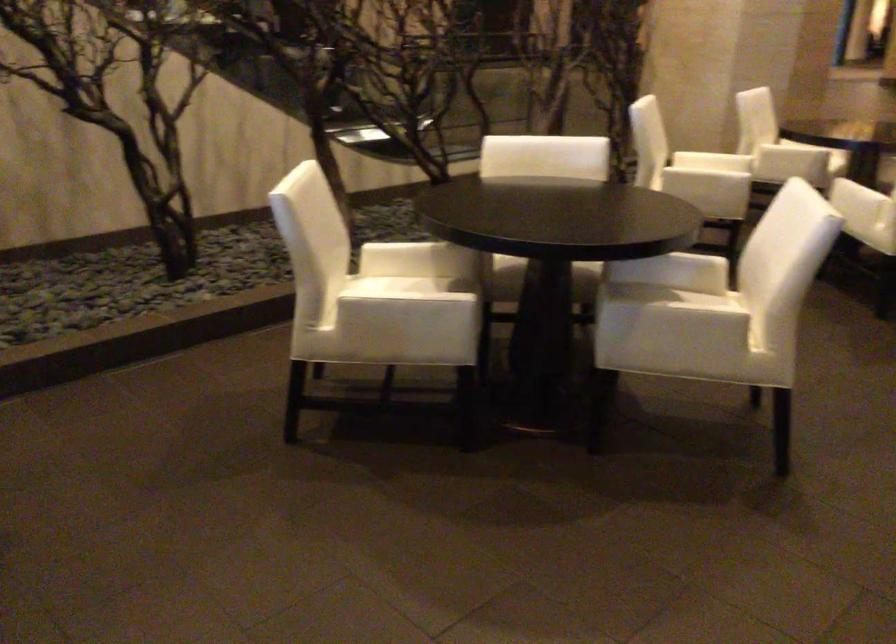
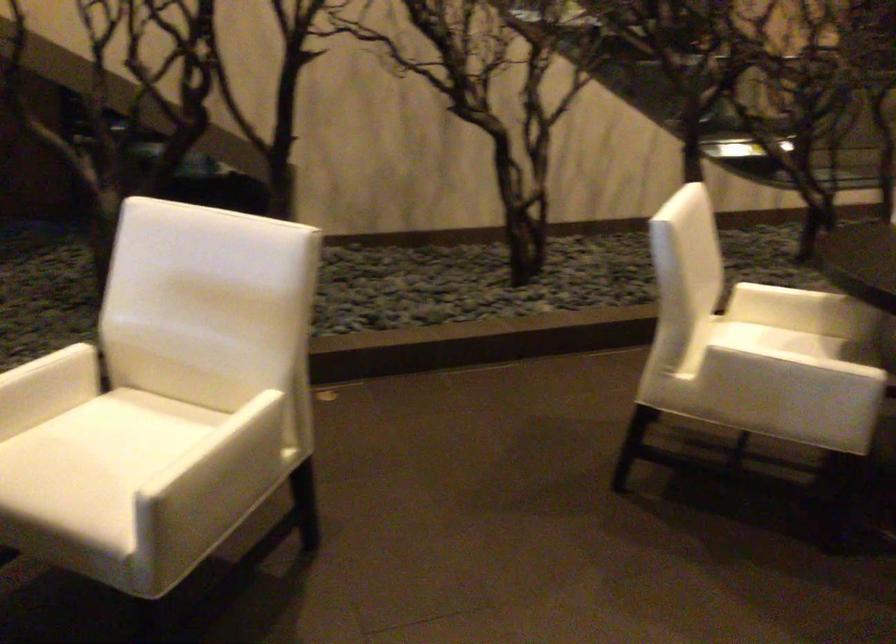
In the second image, find the point that corresponds to the point at 409,289 in the first image.

(791, 341)